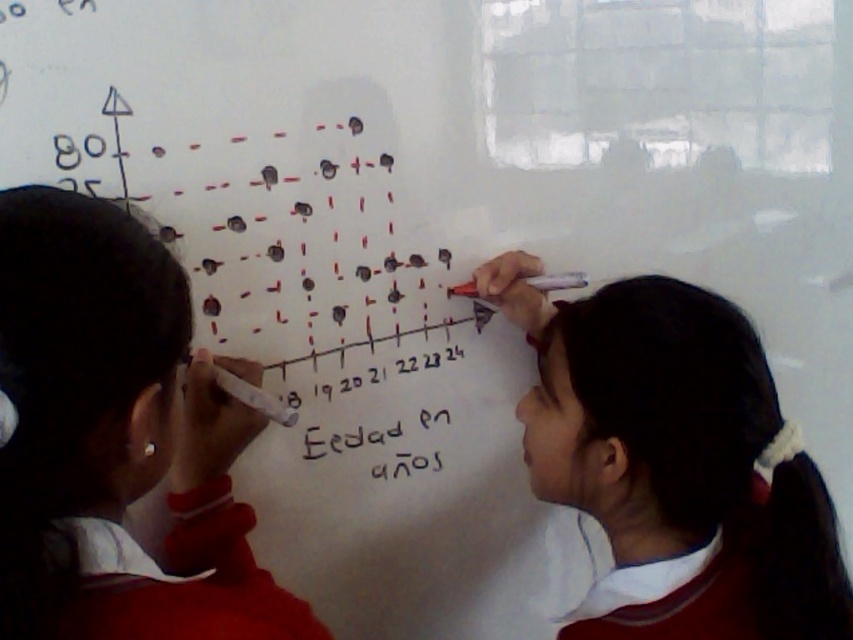
Can you confirm if white uniform at left is positioned to the right of white matte marker at upper right?

In fact, white uniform at left is to the left of white matte marker at upper right.

Does white uniform at left appear on the left side of white matte marker at upper right?

Indeed, white uniform at left is positioned on the left side of white matte marker at upper right.

Is point (115, 532) closer to viewer compared to point (686, 307)?

Yes, point (115, 532) is closer to viewer.

At what (x,y) coordinates should I click in order to perform the action: click on white uniform at left. Please return your answer as a coordinate pair (x, y). The width and height of the screenshot is (853, 640). Looking at the image, I should click on (117, 440).